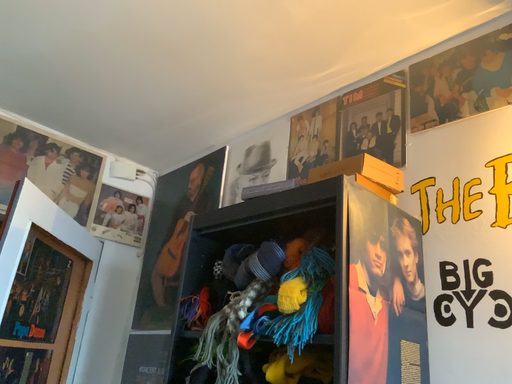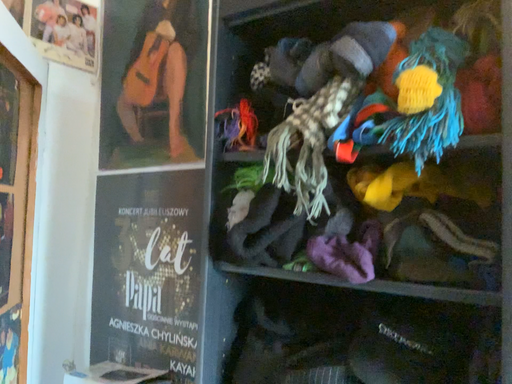
Question: How did the camera likely rotate when shooting the video?

Choices:
 (A) rotated right
 (B) rotated left

Answer: (A)